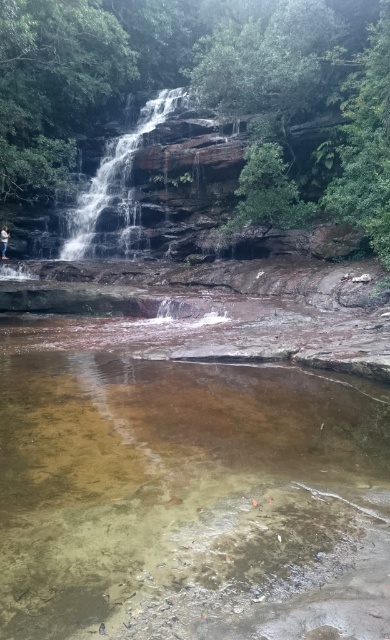
Is clear water at center thinner than white cotton shirt at lower left?

No, clear water at center is not thinner than white cotton shirt at lower left.

Can you confirm if clear water at center is positioned below white cotton shirt at lower left?

Yes.

Locate an element on the screen. clear water at center is located at coordinates (186, 492).

At what (x,y) coordinates should I click in order to perform the action: click on clear water at center. Please return your answer as a coordinate pair (x, y). Looking at the image, I should click on (186, 492).

Which is above, smooth brown rock at center or white cotton shirt at lower left?

smooth brown rock at center is above.

Can you confirm if smooth brown rock at center is positioned to the right of white cotton shirt at lower left?

Yes, smooth brown rock at center is to the right of white cotton shirt at lower left.

This screenshot has width=390, height=640. What do you see at coordinates (113, 173) in the screenshot?
I see `smooth brown rock at center` at bounding box center [113, 173].

The width and height of the screenshot is (390, 640). Find the location of `smooth brown rock at center`. smooth brown rock at center is located at coordinates (113, 173).

Which is behind, point (118, 506) or point (104, 168)?

Positioned behind is point (104, 168).

Can you confirm if clear water at center is wider than smooth brown rock at center?

No.

Does point (83, 492) come behind point (152, 120)?

That is False.

You are a GUI agent. You are given a task and a screenshot of the screen. Output one action in this format:
    pyautogui.click(x=<x>, y=<y>)
    Task: Click on the clear water at center
    
    Given the screenshot: What is the action you would take?
    pyautogui.click(x=186, y=492)